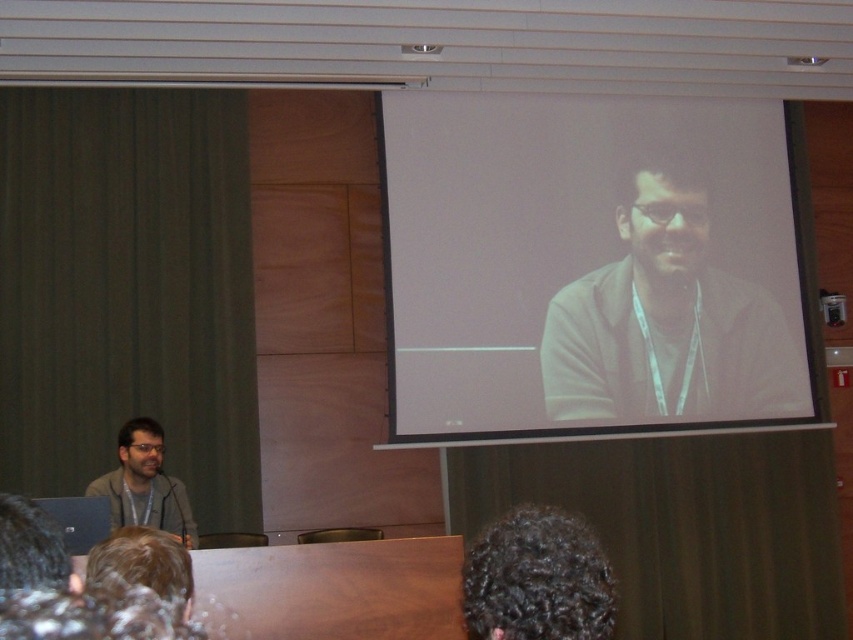
Question: Which point is farther to the camera?

Choices:
 (A) (126, 433)
 (B) (161, 339)

Answer: (B)

Question: Is dark curly hair at lower center further to the viewer compared to matte gray jacket at lower left?

Choices:
 (A) yes
 (B) no

Answer: (B)

Question: Based on their relative distances, which object is nearer to the matte gray jacket at lower left?

Choices:
 (A) green fabric curtain at left
 (B) dark curly hair at lower center
 (C) white matte screen at upper center

Answer: (A)

Question: Can you confirm if white matte screen at upper center is positioned to the right of dark curly hair at lower center?

Choices:
 (A) yes
 (B) no

Answer: (A)

Question: From the image, what is the correct spatial relationship of green fabric curtain at left in relation to matte brown jacket at upper right?

Choices:
 (A) above
 (B) below

Answer: (B)

Question: Which of these objects is positioned farthest from the white matte screen at upper center?

Choices:
 (A) green fabric curtain at left
 (B) matte gray jacket at lower left
 (C) matte brown jacket at upper right

Answer: (B)